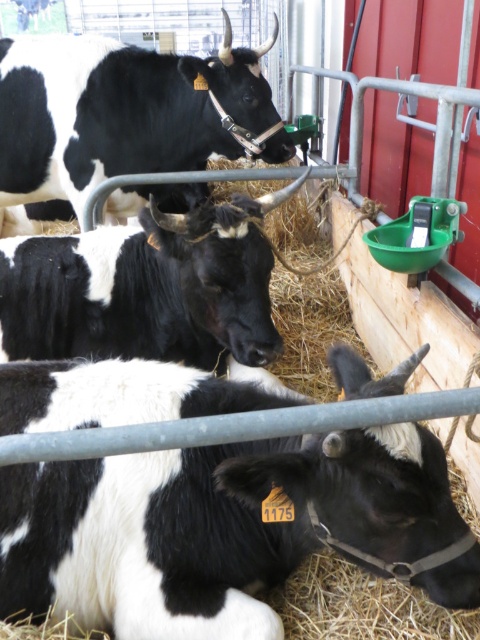
Question: Can you confirm if black and white fur at lower left is smaller than black matte cow at center?

Choices:
 (A) yes
 (B) no

Answer: (A)

Question: Which point is closer to the camera?

Choices:
 (A) black matte cow at upper left
 (B) black and white fur at lower left

Answer: (B)

Question: Estimate the real-world distances between objects in this image. Which object is farther from the black matte cow at center?

Choices:
 (A) black and white fur at lower left
 (B) black matte cow at upper left

Answer: (B)

Question: Which point is closer to the camera taking this photo?

Choices:
 (A) (228, 592)
 (B) (60, 108)
 (C) (168, 256)

Answer: (A)

Question: Can you confirm if black and white fur at lower left is wider than black matte cow at upper left?

Choices:
 (A) no
 (B) yes

Answer: (A)

Question: Is black matte cow at upper left below black matte cow at center?

Choices:
 (A) yes
 (B) no

Answer: (B)